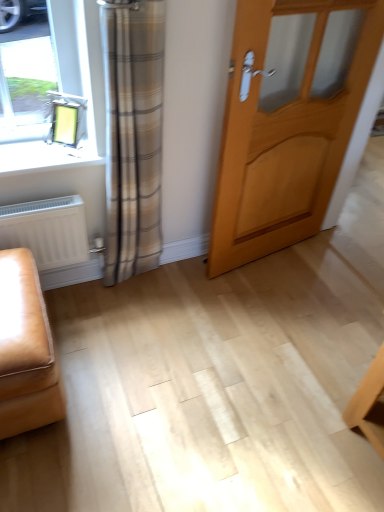
Locate an element on the screen. The width and height of the screenshot is (384, 512). free space between leather ottoman at lower left and light wood door at center is located at coordinates (162, 321).